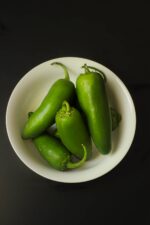
This screenshot has height=225, width=150. I want to click on bottom left shadow in bowl, so click(30, 152).